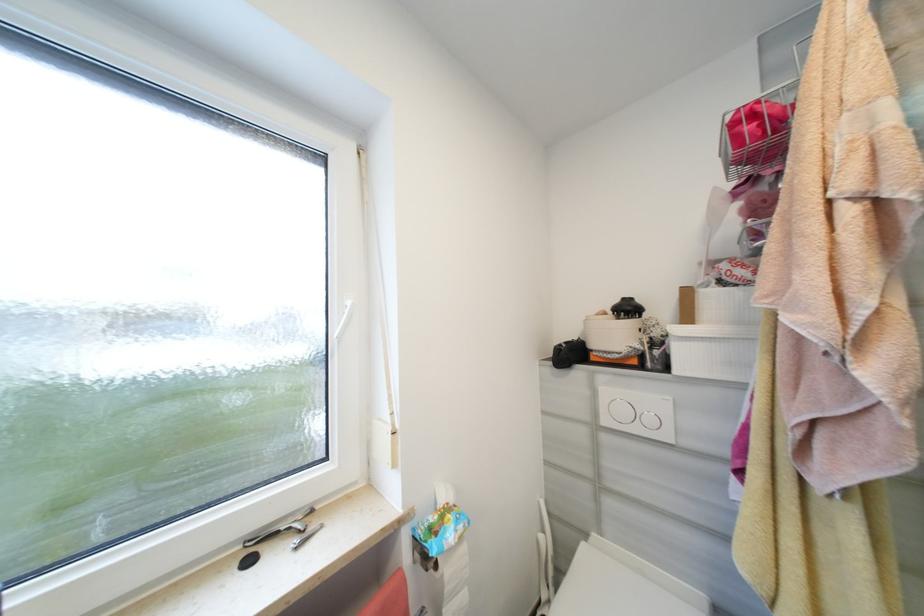
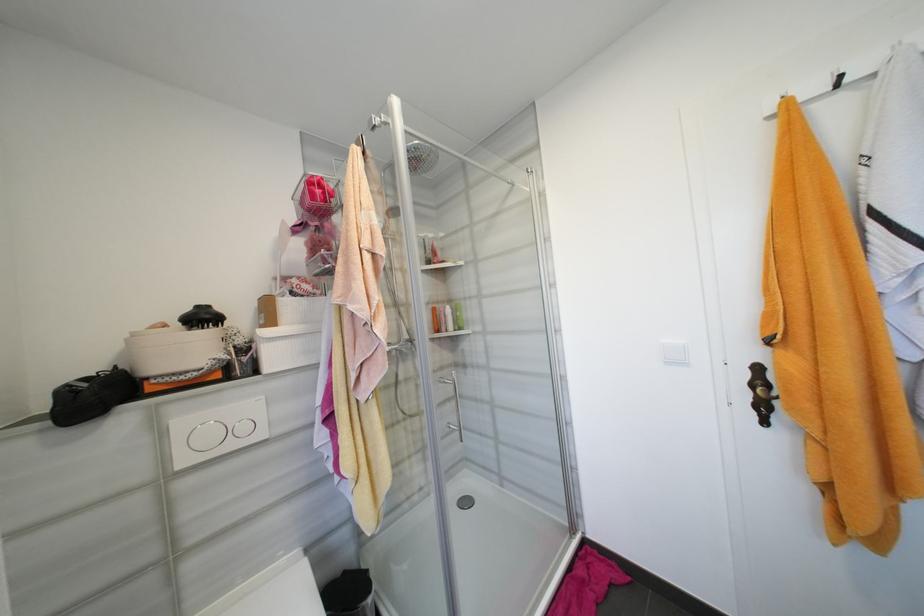
In the second image, find the point that corresponds to (633,310) in the first image.

(210, 318)